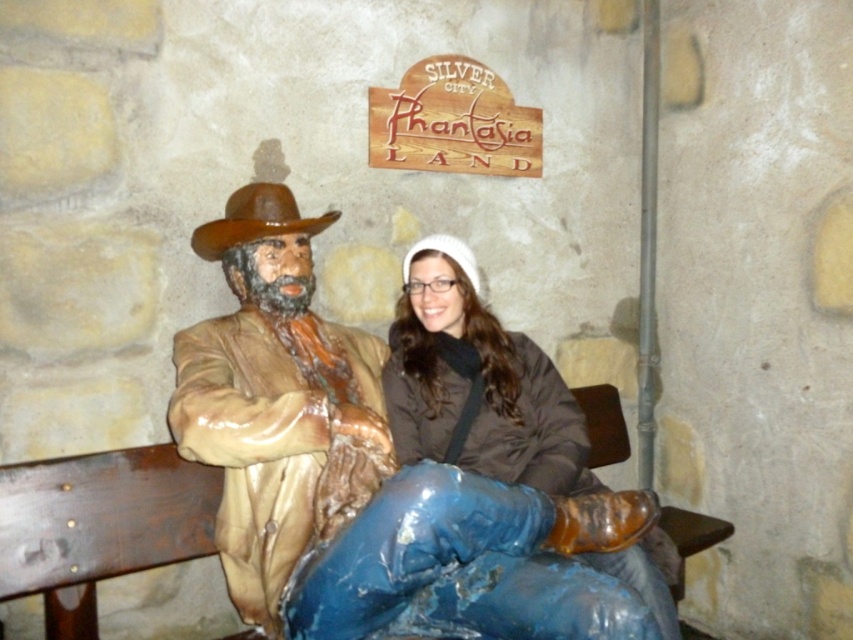
Question: Which object is closer to the camera taking this photo?

Choices:
 (A) matte brown jacket at center
 (B) brown glossy cowboy hat at left
 (C) matte brown statue at left

Answer: (A)

Question: Estimate the real-world distances between objects in this image. Which object is farther from the matte brown jacket at center?

Choices:
 (A) brown glossy cowboy hat at left
 (B) matte brown statue at left

Answer: (A)

Question: Observing the image, what is the correct spatial positioning of matte brown jacket at center in reference to brown glossy cowboy hat at left?

Choices:
 (A) left
 (B) right

Answer: (B)

Question: Can you confirm if matte brown statue at left is thinner than matte brown jacket at center?

Choices:
 (A) no
 (B) yes

Answer: (B)

Question: Does matte brown statue at left have a larger size compared to matte brown jacket at center?

Choices:
 (A) yes
 (B) no

Answer: (B)

Question: Which is nearer to the brown glossy cowboy hat at left?

Choices:
 (A) matte brown statue at left
 (B) matte brown jacket at center

Answer: (A)